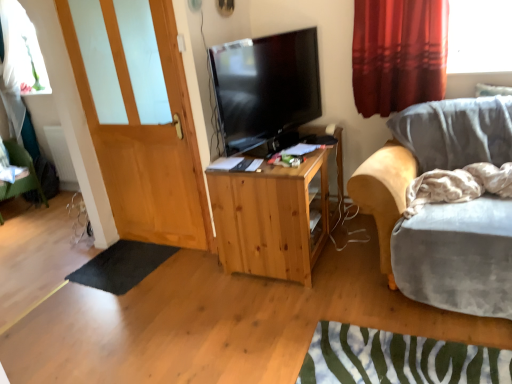
What do you see at coordinates (492, 90) in the screenshot? The width and height of the screenshot is (512, 384). I see `white fabric pillow at upper right` at bounding box center [492, 90].

Where is `natural wood cabinet at center`? The height and width of the screenshot is (384, 512). natural wood cabinet at center is located at coordinates (277, 215).

Locate an element on the screen. wooden door at left is located at coordinates (147, 142).

You are a GUI agent. You are given a task and a screenshot of the screen. Output one action in this format:
    pyautogui.click(x=<x>, y=<y>)
    Task: Click on the black glossy tv at center
    
    Given the screenshot: What is the action you would take?
    pyautogui.click(x=265, y=87)

Where is `green fabric chair at lower left`? This screenshot has width=512, height=384. green fabric chair at lower left is located at coordinates (22, 178).

This screenshot has height=384, width=512. Describe the element at coordinates (60, 153) in the screenshot. I see `white matte radiator at lower left` at that location.

Locate an element on the screen. white fabric pillow at upper right is located at coordinates (492, 90).

Find the location of `blanket below the white fabric pillow at upper right (from a real-world perspective)`. blanket below the white fabric pillow at upper right (from a real-world perspective) is located at coordinates click(458, 185).

Is beige textured blanket at right wider than white fabric pillow at upper right?

Correct, the width of beige textured blanket at right exceeds that of white fabric pillow at upper right.

Is beige textured blanket at right in front of white fabric pillow at upper right?

Yes, beige textured blanket at right is closer to the camera.

From the image's perspective, which is above, beige textured blanket at right or white fabric pillow at upper right?

white fabric pillow at upper right, from the image's perspective.

From the image's perspective, between velvet grey chair at right and beige textured blanket at right, who is located below?

From the image's view, velvet grey chair at right is below.

Is velvet grey chair at right thinner than beige textured blanket at right?

No, velvet grey chair at right is not thinner than beige textured blanket at right.

Can you confirm if velvet grey chair at right is smaller than beige textured blanket at right?

No.

How many degrees apart are the facing directions of white matte radiator at lower left and black glossy tv at center?

The angle between the facing direction of white matte radiator at lower left and the facing direction of black glossy tv at center is 73.3 degrees.

Which of these two, white matte radiator at lower left or black glossy tv at center, stands shorter?

white matte radiator at lower left is shorter.

Is white matte radiator at lower left behind black glossy tv at center?

Yes, it is behind black glossy tv at center.

From the image's perspective, is white matte radiator at lower left above or below black glossy tv at center?

Clearly, from the image's perspective, white matte radiator at lower left is below black glossy tv at center.

Which is more to the left, wooden door at left or natural wood cabinet at center?

Positioned to the left is wooden door at left.

Which object is closer to the camera taking this photo, wooden door at left or natural wood cabinet at center?

natural wood cabinet at center is more forward.

Is wooden door at left far away from natural wood cabinet at center?

That's not correct — wooden door at left is a little close to natural wood cabinet at center.

Which of these two, wooden door at left or natural wood cabinet at center, is thinner?

wooden door at left.

Can you confirm if white fabric pillow at upper right is taller than black rubber mat at lower left?

Correct, white fabric pillow at upper right is much taller as black rubber mat at lower left.

Does white fabric pillow at upper right have a greater width compared to black rubber mat at lower left?

In fact, white fabric pillow at upper right might be narrower than black rubber mat at lower left.

Considering the relative positions of white fabric pillow at upper right and black rubber mat at lower left in the image provided, is white fabric pillow at upper right to the left of black rubber mat at lower left from the viewer's perspective?

Incorrect, white fabric pillow at upper right is not on the left side of black rubber mat at lower left.

From a real-world perspective, is natural wood cabinet at center under red velvet curtain at upper right?

Yes, from a real-world perspective, natural wood cabinet at center is below red velvet curtain at upper right.

Considering the relative sizes of natural wood cabinet at center and red velvet curtain at upper right in the image provided, is natural wood cabinet at center thinner than red velvet curtain at upper right?

No.

Between natural wood cabinet at center and red velvet curtain at upper right, which one has smaller size?

Smaller between the two is red velvet curtain at upper right.

Is point (312, 194) closer or farther from the camera than point (369, 161)?

Clearly, point (312, 194) is more distant from the camera than point (369, 161).

Is natural wood cabinet at center to the left of velvet grey chair at right from the viewer's perspective?

Correct, you'll find natural wood cabinet at center to the left of velvet grey chair at right.

Can velvet grey chair at right be found inside natural wood cabinet at center?

No.

Does natural wood cabinet at center have a smaller size compared to velvet grey chair at right?

Correct, natural wood cabinet at center occupies less space than velvet grey chair at right.

This screenshot has width=512, height=384. I want to click on pillow located above the beige textured blanket at right (from a real-world perspective), so click(x=492, y=90).

At what (x,y) coordinates should I click in order to perform the action: click on blanket above the velvet grey chair at right (from the image's perspective). Please return your answer as a coordinate pair (x, y). Looking at the image, I should click on (458, 185).

When comparing their distances from black rubber mat at lower left, does velvet grey chair at right or red velvet curtain at upper right seem further?

The object further to black rubber mat at lower left is red velvet curtain at upper right.

Consider the image. When comparing their distances from black glossy tv at center, does natural wood cabinet at center or black rubber mat at lower left seem further?

black rubber mat at lower left.

In the scene shown: Which object lies nearer to the anchor point wooden door at left, black rubber mat at lower left or velvet grey chair at right?

black rubber mat at lower left lies closer to wooden door at left than the other object.

From the image, which object appears to be farther from velvet grey chair at right, red velvet curtain at upper right or green fabric chair at lower left?

green fabric chair at lower left lies further to velvet grey chair at right than the other object.

Based on their spatial positions, is natural wood cabinet at center or white fabric pillow at upper right further from green fabric chair at lower left?

white fabric pillow at upper right is further to green fabric chair at lower left.

Looking at the image, which one is located closer to red velvet curtain at upper right, green fabric chair at lower left or white fabric pillow at upper right?

white fabric pillow at upper right is closer to red velvet curtain at upper right.

Estimate the real-world distances between objects in this image. Which object is further from natural wood cabinet at center, black glossy tv at center or wooden door at left?

wooden door at left.

Looking at the image, which one is located further to black glossy tv at center, natural wood cabinet at center or beige textured blanket at right?

Based on the image, beige textured blanket at right appears to be further to black glossy tv at center.

Locate an element on the screen. This screenshot has width=512, height=384. television situated between wooden door at left and red velvet curtain at upper right from left to right is located at coordinates (265, 87).

Locate an element on the screen. The image size is (512, 384). blanket between white matte radiator at lower left and white fabric pillow at upper right is located at coordinates (458, 185).

Where is `blanket between green fabric chair at lower left and white fabric pillow at upper right`? The width and height of the screenshot is (512, 384). blanket between green fabric chair at lower left and white fabric pillow at upper right is located at coordinates pos(458,185).

At what (x,y) coordinates should I click in order to perform the action: click on television between wooden door at left and beige textured blanket at right from left to right. Please return your answer as a coordinate pair (x, y). The image size is (512, 384). Looking at the image, I should click on (265, 87).